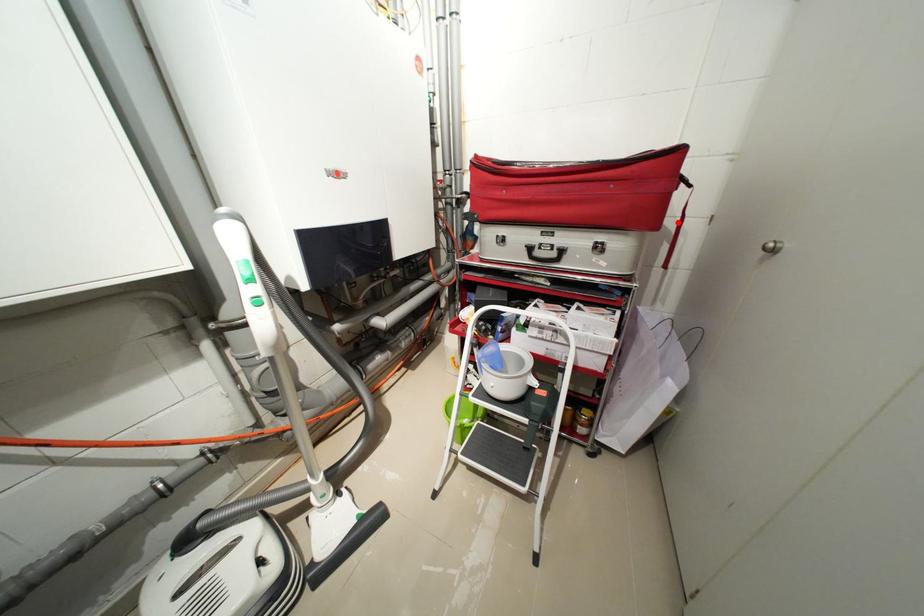
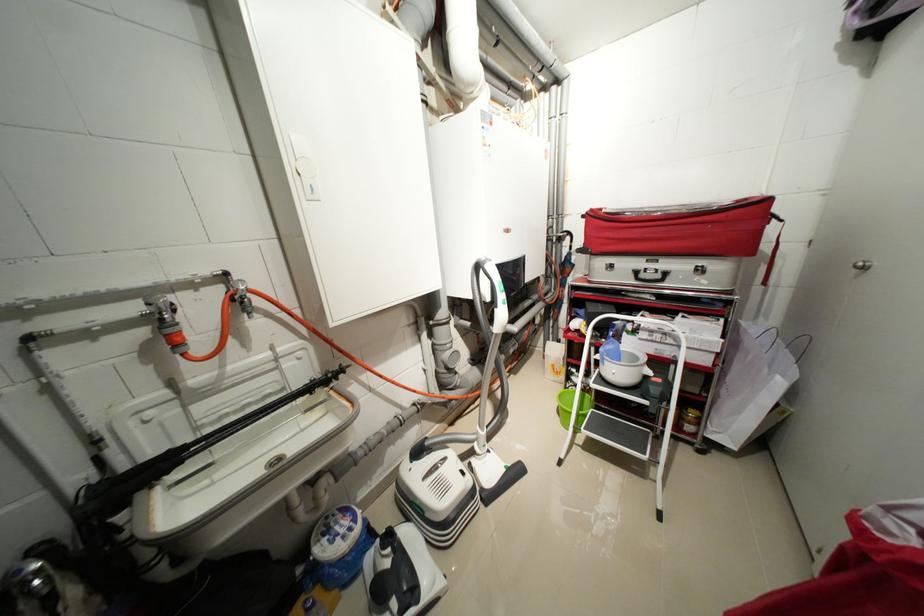
In the second image, find the point that corresponds to the highlighted location in the first image.

(772, 249)